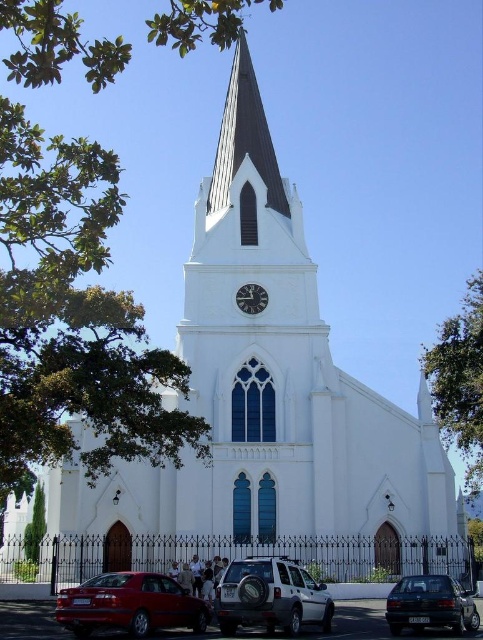
Which is above, silver metallic suv at center or metallic clock face at center?

metallic clock face at center is higher up.

Is silver metallic suv at center thinner than metallic clock face at center?

No.

Is point (311, 611) positioned before point (258, 291)?

Yes, it is in front of point (258, 291).

Image resolution: width=483 pixels, height=640 pixels. I want to click on silver metallic suv at center, so click(270, 596).

Which is in front, point (295, 564) or point (418, 614)?

Positioned in front is point (295, 564).

Who is shorter, silver metallic suv at center or dark gray metallic sedan at lower right?

dark gray metallic sedan at lower right

Identify the location of silver metallic suv at center. (270, 596).

Based on the photo, which of these two, shiny black spire at center or dark gray metallic sedan at lower right, stands taller?

shiny black spire at center is taller.

Does shiny black spire at center have a larger size compared to dark gray metallic sedan at lower right?

Indeed, shiny black spire at center has a larger size compared to dark gray metallic sedan at lower right.

Which is in front, point (265, 172) or point (430, 609)?

Point (430, 609) is in front.

Identify the location of shiny black spire at center. (244, 138).